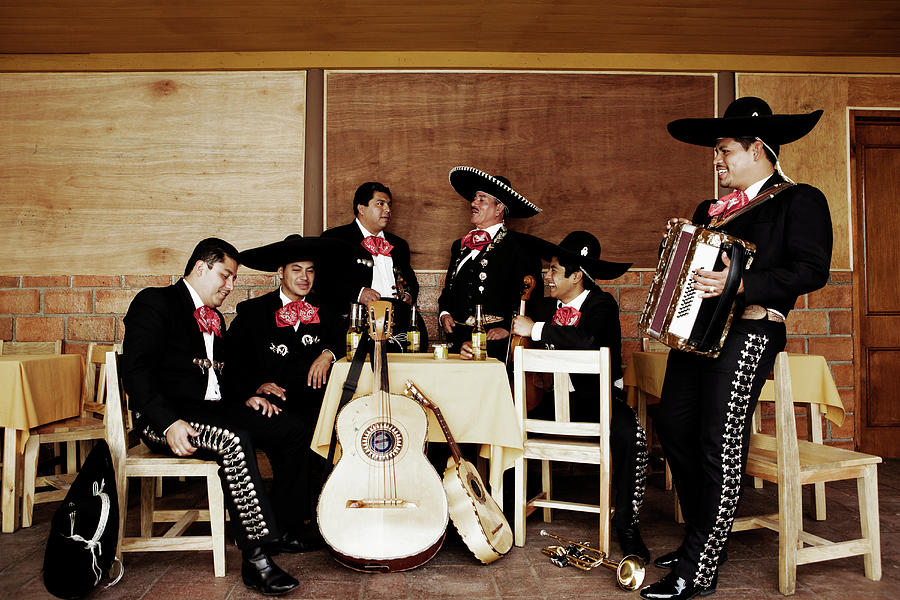
Identify the location of wall. This screenshot has height=600, width=900. (218, 126).